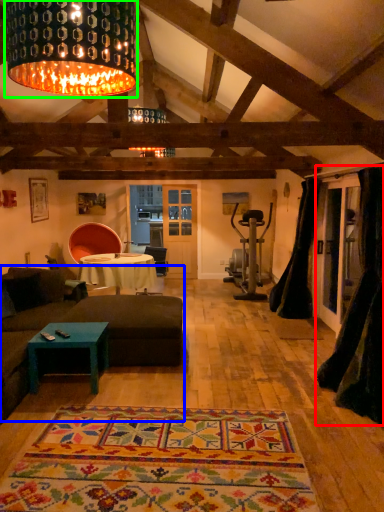
Question: Considering the real-world distances, which object is farthest from curtain (highlighted by a red box)? studio couch (highlighted by a blue box) or lamp (highlighted by a green box)?

Choices:
 (A) studio couch
 (B) lamp

Answer: (B)